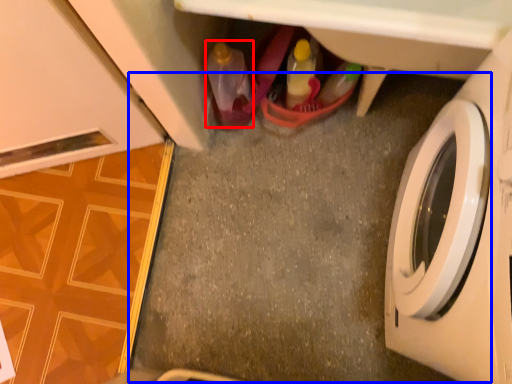
Question: Which object appears closest to the camera in this image, bottle (highlighted by a red box) or concrete (highlighted by a blue box)?

Choices:
 (A) bottle
 (B) concrete

Answer: (A)